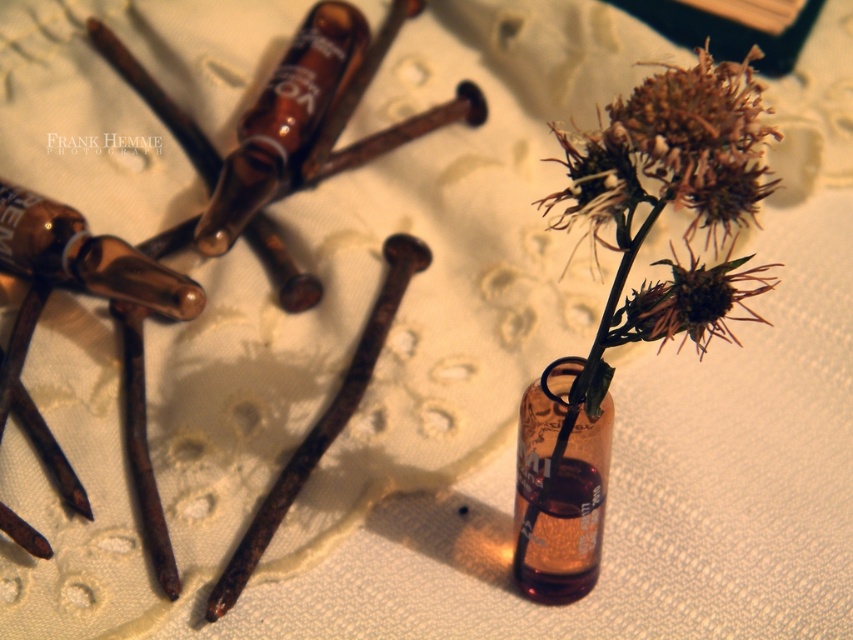
You are looking at the image from above. There are two points marked in the scene. The first point is at coordinates point (660, 132) and the second is at point (78, 285). Which point is closer to you?

Point (660, 132) is in front of point (78, 285), so it is closer to you.

You are a florist arranging flowers for a client who wants to place two thistles exactly 3 inches apart. You have a brown matte thistle at center and a brown spiky thistle at center. Can you arrange them as requested?

The brown matte thistle at center and brown spiky thistle at center are currently 2.77 inches apart. Since 2.77 inches is less than 3 inches, the florist needs to move them slightly further apart to meet the client request.

You are an interior designer arranging items on a table. You have a brown matte thistle at center and a brown glass bottle at upper left. Based on the scene description, which object is closer to you?

The brown glass bottle at upper left is closer to you because the brown matte thistle at center is positioned under it.